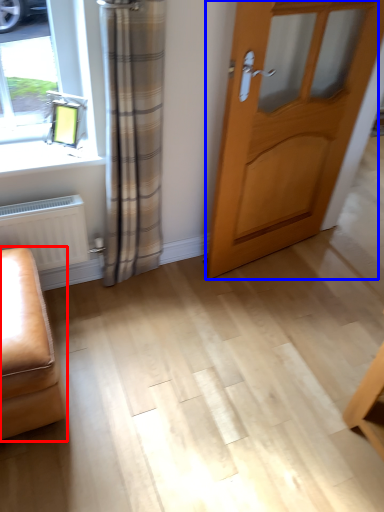
Question: Which of the following is the farthest to the observer, furniture (highlighted by a red box) or door (highlighted by a blue box)?

Choices:
 (A) furniture
 (B) door

Answer: (B)